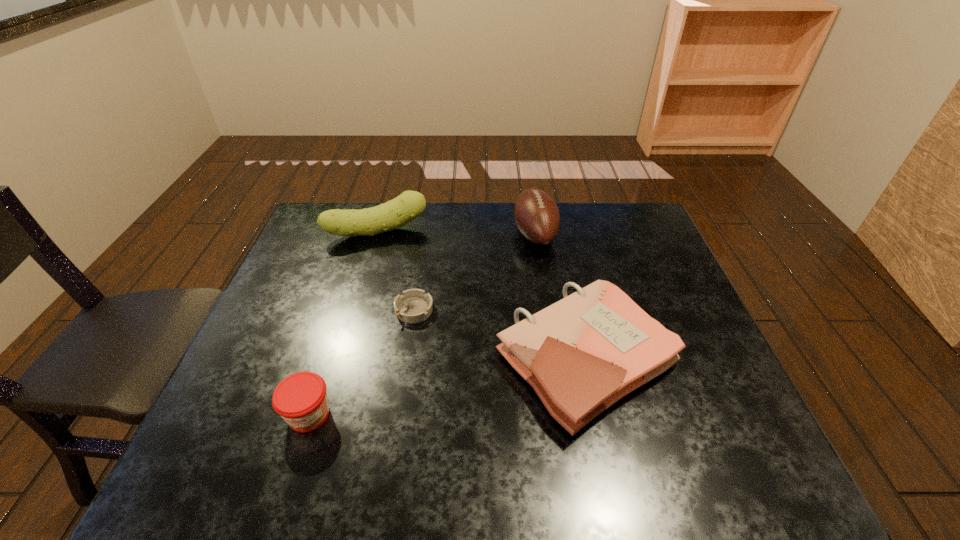
You are a GUI agent. You are given a task and a screenshot of the screen. Output one action in this format:
    pyautogui.click(x=<x>, y=<y>)
    Task: Click on the free space between the football (American) and the ashtray
    
    Given the screenshot: What is the action you would take?
    pyautogui.click(x=474, y=272)

Image resolution: width=960 pixels, height=540 pixels. In order to click on object that ranks as the fourth closest to the cucumber in this screenshot , I will do `click(300, 399)`.

Locate an element on the screen. Image resolution: width=960 pixels, height=540 pixels. object identified as the second closest to the football (American) is located at coordinates (395, 213).

The image size is (960, 540). I want to click on free space in the image that satisfies the following two spatial constraints: 1. on the front side of the cucumber; 2. on the right side of the ashtray, so click(x=354, y=310).

Where is `free space in the image that satisfies the following two spatial constraints: 1. on the front side of the cucumber; 2. on the right side of the shortest object`? free space in the image that satisfies the following two spatial constraints: 1. on the front side of the cucumber; 2. on the right side of the shortest object is located at coordinates (354, 310).